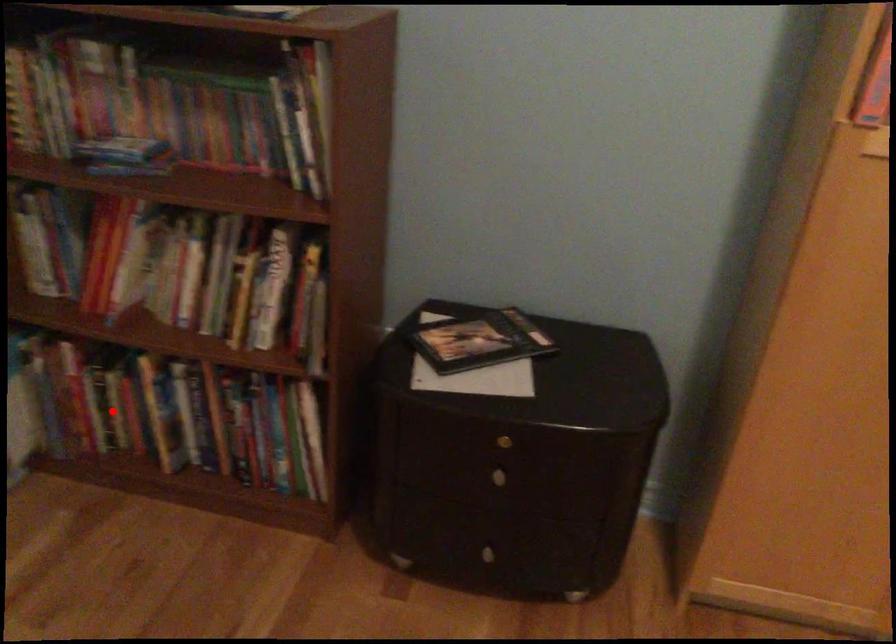
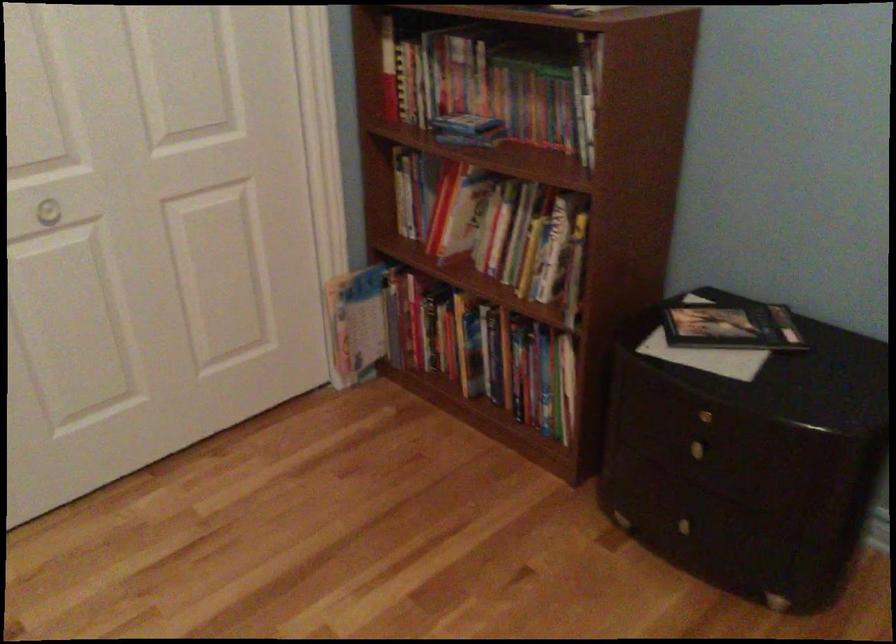
Question: I am providing you with two images of the same scene from different viewpoints. In image1, a red point is highlighted. Considering the same 3D point in image2, which of the following is correct?

Choices:
 (A) It is closer
 (B) It is farther

Answer: (B)